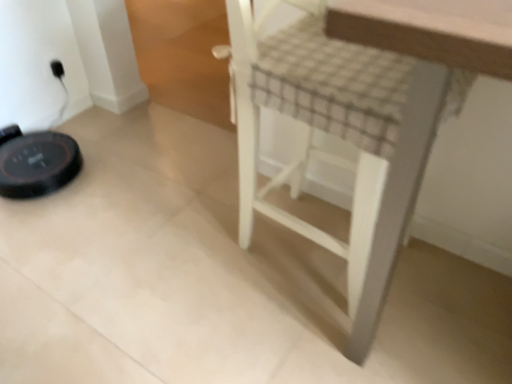
Question: Considering the positions of white wood stool at center and black plastic outlet at upper left in the image, is white wood stool at center bigger or smaller than black plastic outlet at upper left?

Choices:
 (A) big
 (B) small

Answer: (A)

Question: Considering the positions of white wood stool at center and black plastic outlet at upper left in the image, is white wood stool at center taller or shorter than black plastic outlet at upper left?

Choices:
 (A) tall
 (B) short

Answer: (A)

Question: Is white wood stool at center spatially inside black plastic outlet at upper left, or outside of it?

Choices:
 (A) outside
 (B) inside

Answer: (A)

Question: Considering the positions of black plastic outlet at upper left and white wood stool at center in the image, is black plastic outlet at upper left wider or thinner than white wood stool at center?

Choices:
 (A) thin
 (B) wide

Answer: (A)

Question: Would you say black plastic outlet at upper left is inside or outside white wood stool at center?

Choices:
 (A) outside
 (B) inside

Answer: (A)

Question: Would you say black plastic outlet at upper left is to the left or to the right of white wood stool at center in the picture?

Choices:
 (A) left
 (B) right

Answer: (A)

Question: Is black plastic outlet at upper left bigger or smaller than white wood stool at center?

Choices:
 (A) small
 (B) big

Answer: (A)